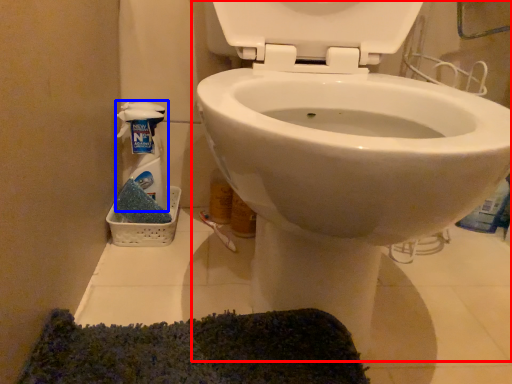
Question: Which object appears farthest to the camera in this image, toilet (highlighted by a red box) or cleaning product (highlighted by a blue box)?

Choices:
 (A) toilet
 (B) cleaning product

Answer: (B)